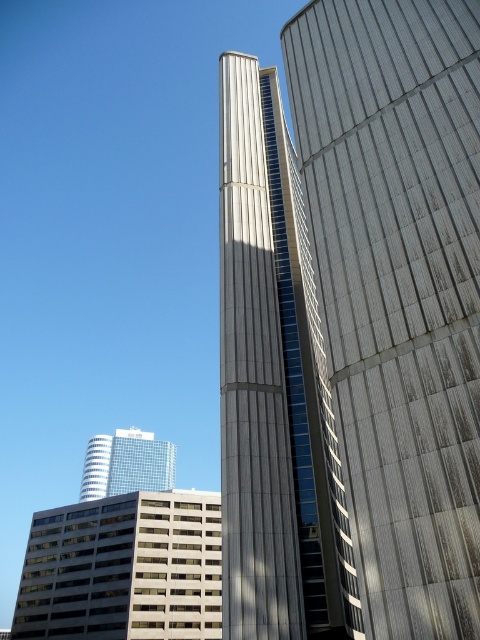
Question: Which point is farther to the camera?

Choices:
 (A) (463, 560)
 (B) (126, 436)
 (C) (85, 472)

Answer: (B)

Question: Does glass windows building at center appear under clear glass skyscraper at center?

Choices:
 (A) no
 (B) yes

Answer: (A)

Question: Which of the following is the farthest from the observer?

Choices:
 (A) (385, 163)
 (B) (173, 529)

Answer: (B)

Question: Where is glass windows building at center located in relation to clear glass skyscraper at center in the image?

Choices:
 (A) below
 (B) above

Answer: (B)

Question: Does gray textured building at right appear over glass windows building at center?

Choices:
 (A) no
 (B) yes

Answer: (B)

Question: Which object appears closest to the camera in this image?

Choices:
 (A) clear glass skyscraper at center
 (B) glassy blue skyscraper at center

Answer: (B)